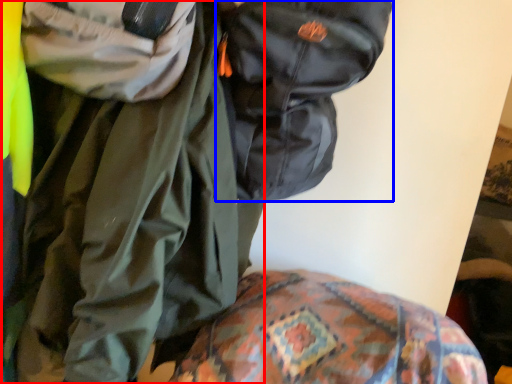
Question: Among these objects, which one is farthest to the camera, jacket (highlighted by a red box) or backpack (highlighted by a blue box)?

Choices:
 (A) jacket
 (B) backpack

Answer: (B)